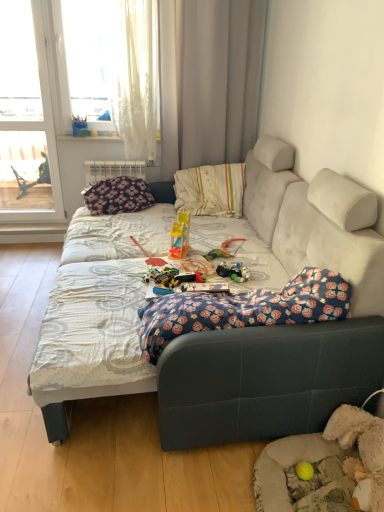
Identify the location of vacant position to the left of fluffy beige dog bed at lower right. coord(211,474).